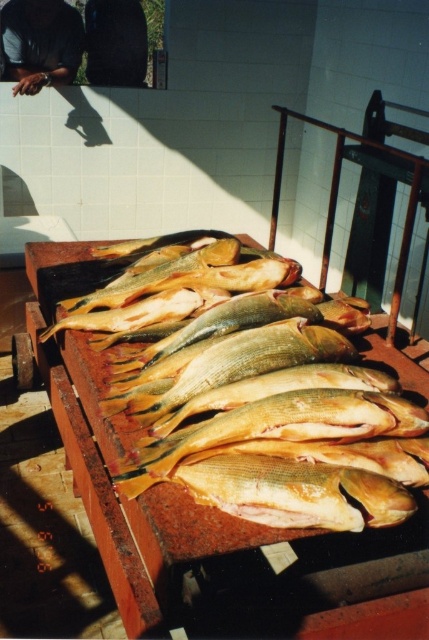
You are a customer at a market and see the yellowish wood table at center and the dark skin smooth hand at upper left. Which object is closer to the right edge of the image?

The yellowish wood table at center is closer to the right edge of the image because it is positioned to the right of the dark skin smooth hand at upper left.

You are a chef preparing to arrange some ingredients on the yellowish wood table at center and the dark skin smooth hand at upper left. Which surface can you place taller items on?

The yellowish wood table at center has a greater height compared to the dark skin smooth hand at upper left, so taller items can be placed on the yellowish wood table at center.

You are a delivery person who needs to place a 3.5 feet long box between the yellowish wood table at center and the fish on the red metal cart. Is there enough space between them to fit the box?

The distance between the yellowish wood table at center and the fish on the red metal cart is 4.10 feet. Since the box is 3.5 feet long, it can fit between them as there is enough space.